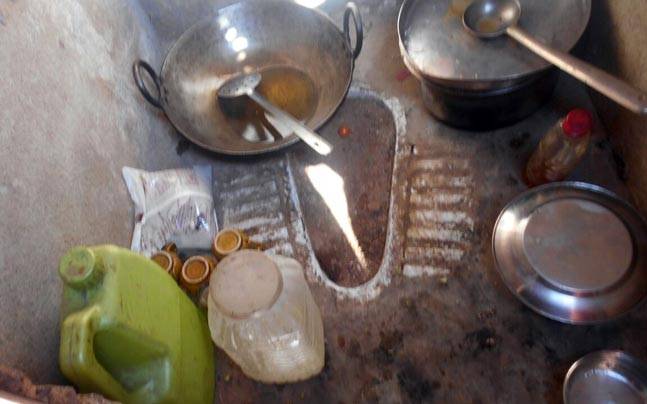
Image resolution: width=647 pixels, height=404 pixels. Identify the location of wok. click(x=250, y=35).